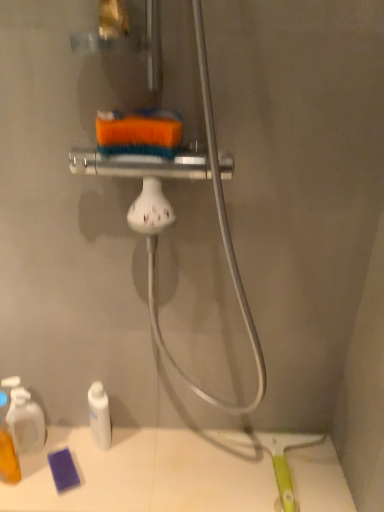
Find the location of a particular element. The height and width of the screenshot is (512, 384). unoccupied region to the right of white matte bottle at lower left, the 1th toiletry positioned from the right is located at coordinates (157, 456).